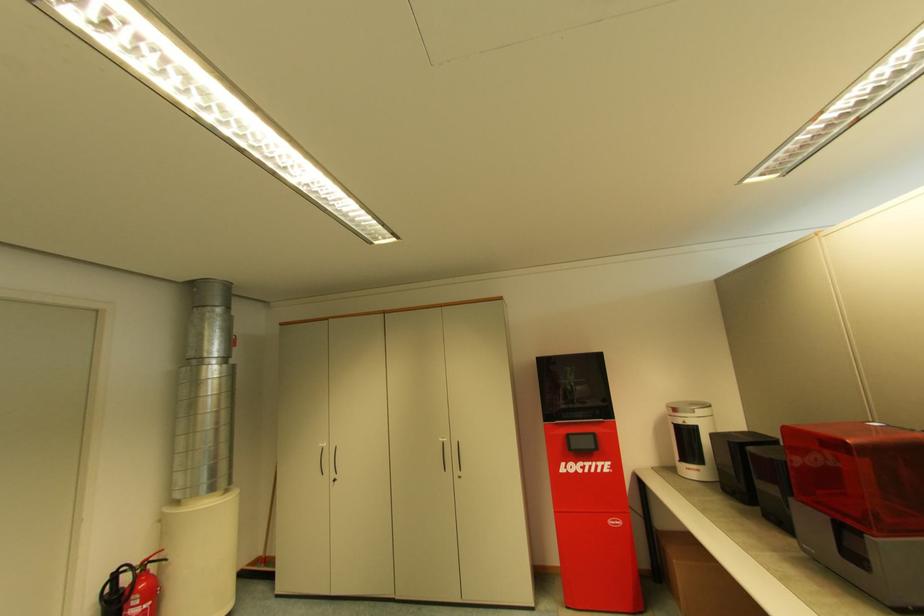
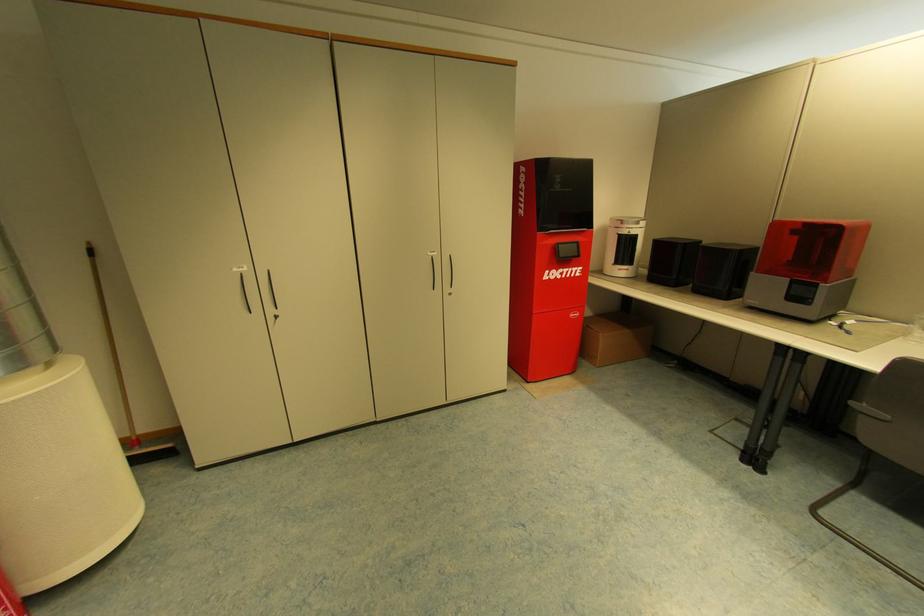
In the second image, find the point that corresponds to point 772,456 in the first image.

(733, 248)